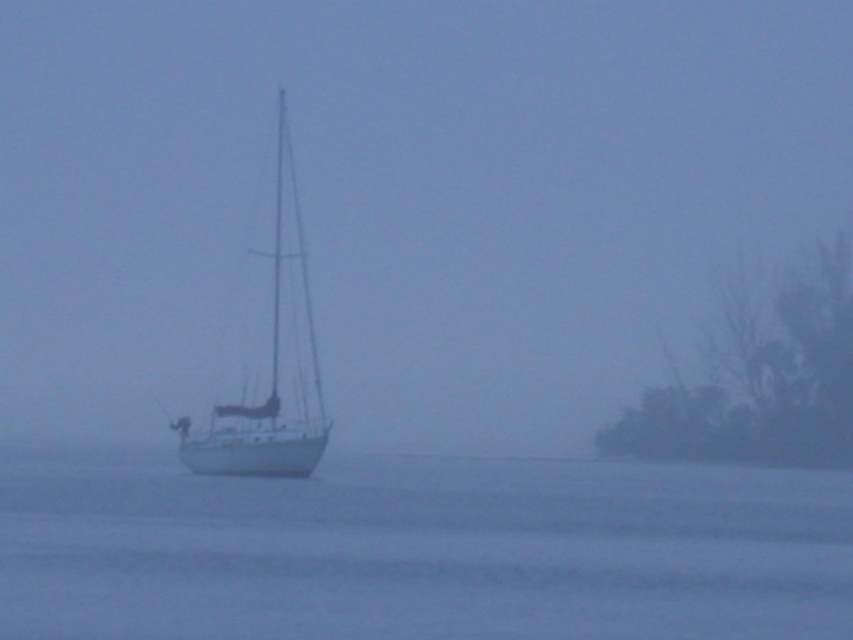
You are a photographer trying to capture the foggy white sailboat at center and the white matte sailboat at center in a single shot. Since the camera can only focus on one boat clearly, which boat should you choose to ensure it fills more of the frame?

The foggy white sailboat at center is larger in size than the white matte sailboat at center, so you should focus on the foggy white sailboat at center to fill more of the frame.

You are standing at the point marked as point (677, 564) in the image. The camera is positioned 114.14 feet away from you. If you want to take a photo of the sailboat, which is the main subject in the scene, would you be able to see the sailboat clearly in your viewfinder?

Yes, you can see the sailboat clearly because the camera is positioned 114.14 feet away from point (677, 564), and the sailboat is the main subject in the scene.

You are an observer looking at the scene. You notice the white water at center and the white matte sailboat at center. Which object is positioned closer to you?

The white water at center is closer to the viewer than the white matte sailboat at center.